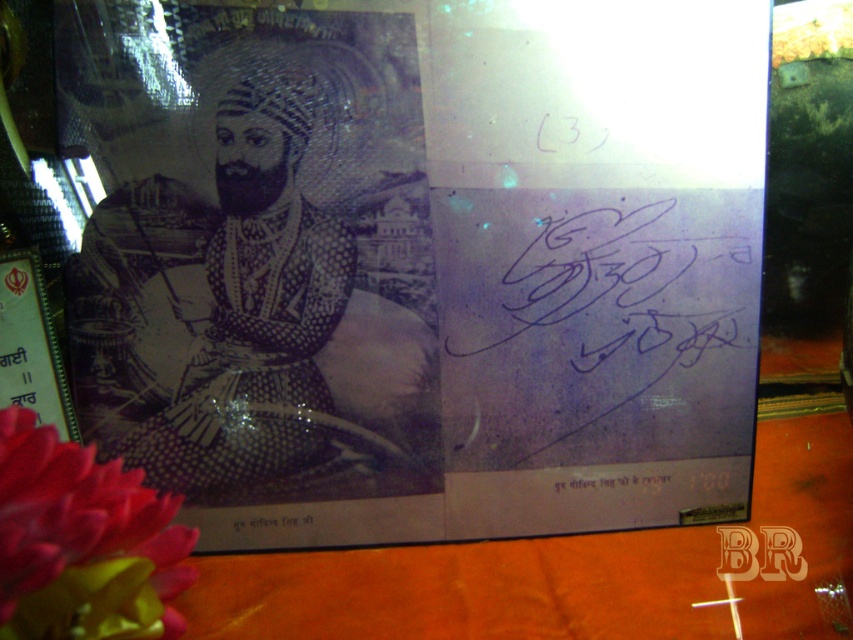
In the scene shown: Can you confirm if black paper portrait at upper left is shorter than matte pink petals at lower left?

Incorrect, black paper portrait at upper left's height does not fall short of matte pink petals at lower left's.

What do you see at coordinates (421, 259) in the screenshot? Image resolution: width=853 pixels, height=640 pixels. I see `black paper portrait at upper left` at bounding box center [421, 259].

Locate an element on the screen. The image size is (853, 640). black paper portrait at upper left is located at coordinates (421, 259).

In the scene shown: Between black paper portrait at upper left and black ink signature at lower center, which one is positioned lower?

Positioned lower is black ink signature at lower center.

This screenshot has width=853, height=640. What do you see at coordinates (421, 259) in the screenshot?
I see `black paper portrait at upper left` at bounding box center [421, 259].

Where is `black paper portrait at upper left`? The image size is (853, 640). black paper portrait at upper left is located at coordinates (421, 259).

Which is more to the right, matte pink petals at lower left or black ink signature at lower center?

black ink signature at lower center

Does matte pink petals at lower left have a lesser width compared to black ink signature at lower center?

No.

This screenshot has height=640, width=853. I want to click on matte pink petals at lower left, so click(x=80, y=540).

The image size is (853, 640). In order to click on matte pink petals at lower left in this screenshot , I will do `click(80, 540)`.